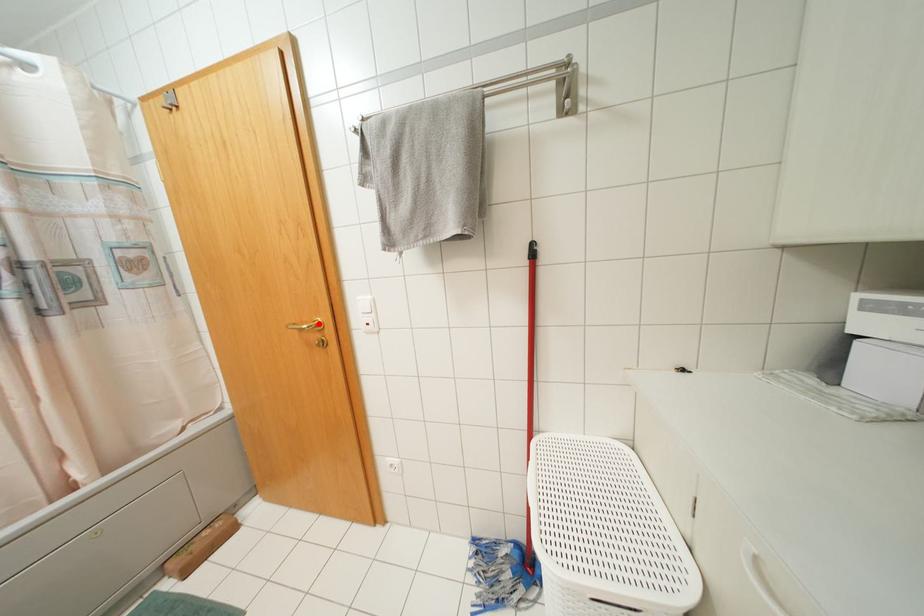
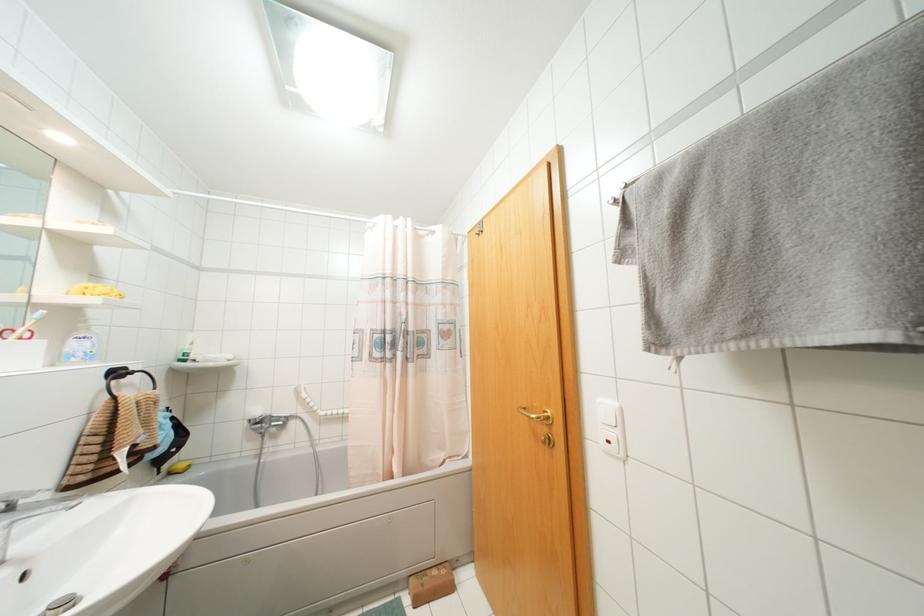
The point at the highlighted location is marked in the first image. Where is the corresponding point in the second image?

(546, 416)